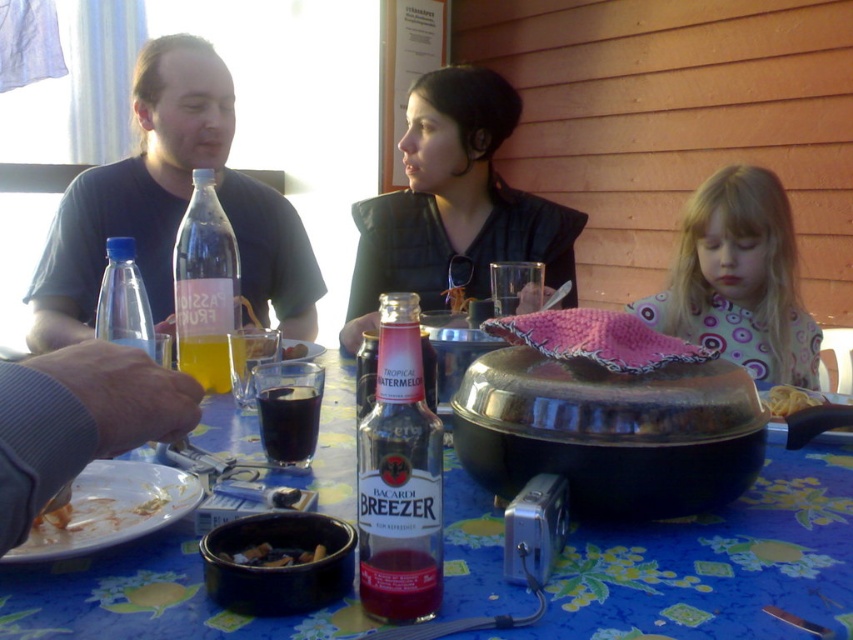
You are a waiter at the restaurant. You need to place a new drink order on the table. Where should you place it so it doesn not interfere with the pink fabric at center and the transparent plastic bottle at left?

The new drink order should be placed in an area away from the pink fabric at center and the transparent plastic bottle at left. Since the pink fabric at center might be wider than the transparent plastic bottle at left, you can place the drink in the remaining space near the edge of the table or next to the silver digital camera near the bottom right corner to avoid interference.

You are a waiter at the outdoor dining area. You need to place a new order of drinks on the table. The drinks are in a clear plastic bottle at center and a white glossy plate at lower left. Which object should you place the drinks on?

The clear plastic bottle at center is larger in size than the white glossy plate at lower left, so the drinks should be placed on the white glossy plate at lower left since it is the appropriate surface for holding drinks.

You are standing at the edge of the table in the outdoor dining scene. You see a point marked at coordinates (740, 280). What object is located at that point?

The point at coordinates (740, 280) marks the pink fabric at center.